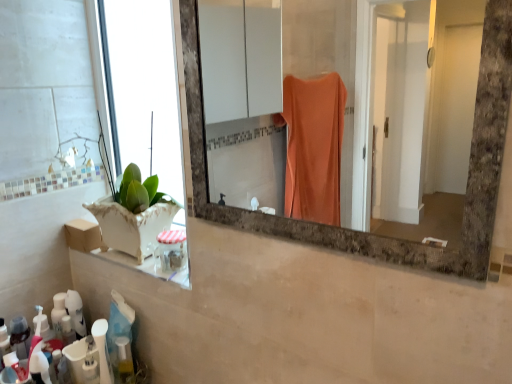
Identify the location of translucent plastic toothbrush at lower left, the first toiletry from the left. Image resolution: width=512 pixels, height=384 pixels. (14, 370).

This screenshot has height=384, width=512. Find the location of `green leafy plant at left`. green leafy plant at left is located at coordinates (143, 126).

I want to click on white plastic bottle at lower left, which is the 3th toiletry from bottom to top, so click(x=102, y=350).

In order to face white glossy lotion at lower left, placed as the 3th toiletry when sorted from top to bottom, should I rotate leftwards or rightwards?

A 20.766 degree turn to the left will do.

Where is `translucent plastic toothbrush at lower left, acting as the fourth toiletry starting from the right`? Image resolution: width=512 pixels, height=384 pixels. translucent plastic toothbrush at lower left, acting as the fourth toiletry starting from the right is located at coordinates (14, 370).

Consider the image. From a real-world perspective, between white glossy lotion at lower left, arranged as the 2th toiletry when ordered from the bottom, and marble frame mirror at center, who is vertically lower?

white glossy lotion at lower left, arranged as the 2th toiletry when ordered from the bottom, from a real-world perspective.

Identify the location of mirror above the white glossy lotion at lower left, arranged as the 2th toiletry when ordered from the bottom (from the image's perspective). Image resolution: width=512 pixels, height=384 pixels. (325, 61).

Looking at this image, considering the sizes of white glossy lotion at lower left, arranged as the 2th toiletry when ordered from the bottom, and marble frame mirror at center in the image, is white glossy lotion at lower left, arranged as the 2th toiletry when ordered from the bottom, wider or thinner than marble frame mirror at center?

white glossy lotion at lower left, arranged as the 2th toiletry when ordered from the bottom, is wider than marble frame mirror at center.

Is white glossy lotion at lower left, arranged as the 2th toiletry when ordered from the bottom, far from marble frame mirror at center?

Indeed, white glossy lotion at lower left, arranged as the 2th toiletry when ordered from the bottom, is not near marble frame mirror at center.

Is white plastic bottle at lower left, which is the 3th toiletry from bottom to top, far from green leafy plant at left?

No, there isn't a large distance between white plastic bottle at lower left, which is the 3th toiletry from bottom to top, and green leafy plant at left.

From a real-world perspective, which toiletry is the 2nd one underneath the green leafy plant at left? Please provide its 2D coordinates.

[(102, 350)]

From the image's perspective, would you say white plastic bottle at lower left, acting as the second toiletry starting from the right, is shown under green leafy plant at left?

Yes, from the image's perspective, white plastic bottle at lower left, acting as the second toiletry starting from the right, is beneath green leafy plant at left.

From a real-world perspective, which is physically above, white plastic bottle at lower left, which is the 3th toiletry from bottom to top, or green leafy plant at left?

From a 3D spatial view, green leafy plant at left is above.

Is marble frame mirror at center taller or shorter than clear plastic jar at lower left, the 4th toiletry in the left-to-right sequence?

marble frame mirror at center is taller than clear plastic jar at lower left, the 4th toiletry in the left-to-right sequence.

Is marble frame mirror at center inside the boundaries of clear plastic jar at lower left, the first toiletry viewed from the right, or outside?

marble frame mirror at center exists outside the volume of clear plastic jar at lower left, the first toiletry viewed from the right.

Is translucent plastic toothbrush at lower left, which is the first toiletry in bottom-to-top order, turned away from clear plastic jar at lower left, arranged as the 1th toiletry when viewed from the top?

translucent plastic toothbrush at lower left, which is the first toiletry in bottom-to-top order, is not turned away from clear plastic jar at lower left, arranged as the 1th toiletry when viewed from the top.

Measure the distance from translucent plastic toothbrush at lower left, the first toiletry from the left, to clear plastic jar at lower left, which is the 4th toiletry from bottom to top.

translucent plastic toothbrush at lower left, the first toiletry from the left, and clear plastic jar at lower left, which is the 4th toiletry from bottom to top, are 18.55 inches apart from each other.

Based on the photo, does translucent plastic toothbrush at lower left, the fourth toiletry from the top, come behind clear plastic jar at lower left, the 4th toiletry in the left-to-right sequence?

That is False.

The height and width of the screenshot is (384, 512). I want to click on the 2nd toiletry in front when counting from the clear plastic jar at lower left, arranged as the 1th toiletry when viewed from the top, so click(x=14, y=370).

From the image's perspective, does white glossy lotion at lower left, which appears as the third toiletry when viewed from the right, appear higher than translucent plastic toothbrush at lower left, the first toiletry from the left?

Yes, from the image's perspective, white glossy lotion at lower left, which appears as the third toiletry when viewed from the right, is above translucent plastic toothbrush at lower left, the first toiletry from the left.

Looking at the image, does white glossy lotion at lower left, which appears as the third toiletry when viewed from the right, seem bigger or smaller compared to translucent plastic toothbrush at lower left, acting as the fourth toiletry starting from the right?

white glossy lotion at lower left, which appears as the third toiletry when viewed from the right, is smaller than translucent plastic toothbrush at lower left, acting as the fourth toiletry starting from the right.

How many degrees apart are the facing directions of white glossy lotion at lower left, arranged as the 2th toiletry when ordered from the bottom, and translucent plastic toothbrush at lower left, the first toiletry from the left?

They differ by 4.27 degrees in their facing directions.

Which is behind, white glossy lotion at lower left, which appears as the third toiletry when viewed from the right, or translucent plastic toothbrush at lower left, acting as the fourth toiletry starting from the right?

white glossy lotion at lower left, which appears as the third toiletry when viewed from the right, is further from the camera.

Considering the positions of objects white plastic bottle at lower left, acting as the second toiletry starting from the right, and white glossy lotion at lower left, arranged as the 2th toiletry when ordered from the bottom, in the image provided, who is more to the right, white plastic bottle at lower left, acting as the second toiletry starting from the right, or white glossy lotion at lower left, arranged as the 2th toiletry when ordered from the bottom,?

white plastic bottle at lower left, acting as the second toiletry starting from the right.

In terms of height, does white plastic bottle at lower left, which is the 3th toiletry from bottom to top, look taller or shorter compared to white glossy lotion at lower left, which is the 2th toiletry from left to right?

white plastic bottle at lower left, which is the 3th toiletry from bottom to top, is taller than white glossy lotion at lower left, which is the 2th toiletry from left to right.

From the image's perspective, would you say white plastic bottle at lower left, placed as the 2th toiletry when sorted from top to bottom, is shown under white glossy lotion at lower left, placed as the 3th toiletry when sorted from top to bottom?

No, from the image's perspective, white plastic bottle at lower left, placed as the 2th toiletry when sorted from top to bottom, is not below white glossy lotion at lower left, placed as the 3th toiletry when sorted from top to bottom.

You are a GUI agent. You are given a task and a screenshot of the screen. Output one action in this format:
    pyautogui.click(x=<x>, y=<y>)
    Task: Click on the toiletry that is the 1st object located below the white plastic bottle at lower left, acting as the second toiletry starting from the right (from the image's perspective)
    
    Given the screenshot: What is the action you would take?
    pyautogui.click(x=91, y=362)

Considering the sizes of objects white plastic bottle at lower left, which is the 3th toiletry from bottom to top, and clear plastic jar at lower left, which is the 4th toiletry from bottom to top, in the image provided, who is smaller, white plastic bottle at lower left, which is the 3th toiletry from bottom to top, or clear plastic jar at lower left, which is the 4th toiletry from bottom to top,?

Smaller between the two is white plastic bottle at lower left, which is the 3th toiletry from bottom to top.

How different are the orientations of white plastic bottle at lower left, which is the 3th toiletry from bottom to top, and clear plastic jar at lower left, which is the 4th toiletry from bottom to top, in degrees?

The angle between the facing direction of white plastic bottle at lower left, which is the 3th toiletry from bottom to top, and the facing direction of clear plastic jar at lower left, which is the 4th toiletry from bottom to top, is 37.6 degrees.

Is white plastic bottle at lower left, placed as the 2th toiletry when sorted from top to bottom, outside of clear plastic jar at lower left, the first toiletry viewed from the right?

white plastic bottle at lower left, placed as the 2th toiletry when sorted from top to bottom, is positioned outside clear plastic jar at lower left, the first toiletry viewed from the right.

Which point is more forward, (112, 382) or (157, 260)?

Point (157, 260)

From the marble frame mirror at center, count 4th toiletrys backward and point to it. Please provide its 2D coordinates.

[(91, 362)]

From the image's perspective, which toiletry is the 2nd one below the green leafy plant at left? Please provide its 2D coordinates.

[(102, 350)]

Which object lies further to the anchor point clear plastic jar at lower left, the first toiletry viewed from the right, marble frame mirror at center or green leafy plant at left?

marble frame mirror at center is positioned further to the anchor clear plastic jar at lower left, the first toiletry viewed from the right.

When comparing their distances from white plastic bottle at lower left, placed as the 2th toiletry when sorted from top to bottom, does white glossy lotion at lower left, which is the 2th toiletry from left to right, or marble frame mirror at center seem further?

The object further to white plastic bottle at lower left, placed as the 2th toiletry when sorted from top to bottom, is marble frame mirror at center.

Looking at the image, which one is located closer to translucent plastic toothbrush at lower left, the fourth toiletry from the top, white plastic bottle at lower left, which is the 3th toiletry from bottom to top, or white glossy lotion at lower left, arranged as the 2th toiletry when ordered from the bottom?

white glossy lotion at lower left, arranged as the 2th toiletry when ordered from the bottom, is closer to translucent plastic toothbrush at lower left, the fourth toiletry from the top.

Considering their positions, is translucent plastic toothbrush at lower left, the first toiletry from the left, positioned closer to marble frame mirror at center than clear plastic jar at lower left, the first toiletry viewed from the right?

clear plastic jar at lower left, the first toiletry viewed from the right, lies closer to marble frame mirror at center than the other object.

Based on their spatial positions, is white plastic bottle at lower left, which is the 3th toiletry from bottom to top, or translucent plastic toothbrush at lower left, the fourth toiletry from the top, closer to marble frame mirror at center?

Among the two, white plastic bottle at lower left, which is the 3th toiletry from bottom to top, is located nearer to marble frame mirror at center.

Based on the photo, which object lies further to the anchor point marble frame mirror at center, green leafy plant at left or clear plastic jar at lower left, the first toiletry viewed from the right?

Based on the image, clear plastic jar at lower left, the first toiletry viewed from the right, appears to be further to marble frame mirror at center.

Which object lies further to the anchor point marble frame mirror at center, white glossy lotion at lower left, placed as the 3th toiletry when sorted from top to bottom, or translucent plastic toothbrush at lower left, the first toiletry from the left?

translucent plastic toothbrush at lower left, the first toiletry from the left, is positioned further to the anchor marble frame mirror at center.

Looking at this image, based on their spatial positions, is translucent plastic toothbrush at lower left, the fourth toiletry from the top, or white glossy lotion at lower left, arranged as the 2th toiletry when ordered from the bottom, closer to green leafy plant at left?

Based on the image, white glossy lotion at lower left, arranged as the 2th toiletry when ordered from the bottom, appears to be nearer to green leafy plant at left.

Locate an element on the screen. The width and height of the screenshot is (512, 384). toiletry located between translucent plastic toothbrush at lower left, the fourth toiletry from the top, and white plastic bottle at lower left, placed as the 2th toiletry when sorted from top to bottom, in the left-right direction is located at coordinates (91, 362).

Locate an element on the screen. mirror between green leafy plant at left and white glossy lotion at lower left, which appears as the third toiletry when viewed from the right, in the vertical direction is located at coordinates (325, 61).

Find the location of a particular element. mirror between green leafy plant at left and white plastic bottle at lower left, placed as the 2th toiletry when sorted from top to bottom, from top to bottom is located at coordinates (325, 61).

The width and height of the screenshot is (512, 384). In order to click on toiletry between clear plastic jar at lower left, the first toiletry viewed from the right, and white glossy lotion at lower left, arranged as the 2th toiletry when ordered from the bottom, in the vertical direction in this screenshot , I will do `click(102, 350)`.